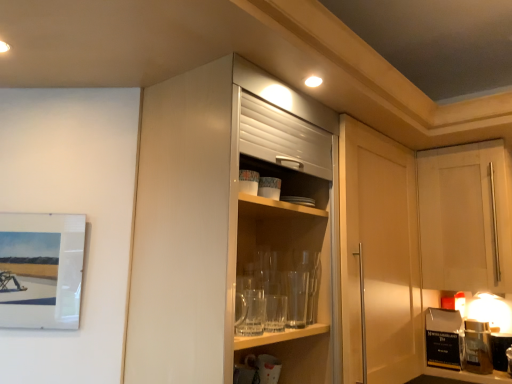
Question: Does glossy white cabinet at center, acting as the second cabinetry starting from the right, have a greater width compared to white matte cabinet at upper right, which appears as the first cabinetry when viewed from the right?

Choices:
 (A) no
 (B) yes

Answer: (A)

Question: Is glossy white cabinet at center, the 1th cabinetry positioned from the left, far from white matte cabinet at upper right, the first cabinetry viewed from the back?

Choices:
 (A) no
 (B) yes

Answer: (A)

Question: Is glossy white cabinet at center, the second cabinetry in the back-to-front sequence, further to camera compared to white matte cabinet at upper right, the first cabinetry viewed from the back?

Choices:
 (A) yes
 (B) no

Answer: (B)

Question: Can you confirm if glossy white cabinet at center, the second cabinetry in the back-to-front sequence, is taller than white matte cabinet at upper right, the second cabinetry from the left?

Choices:
 (A) yes
 (B) no

Answer: (A)

Question: Does glossy white cabinet at center, acting as the second cabinetry starting from the right, appear on the right side of white matte cabinet at upper right, acting as the 2th cabinetry starting from the front?

Choices:
 (A) no
 (B) yes

Answer: (A)

Question: Is point (9, 321) closer or farther from the camera than point (486, 263)?

Choices:
 (A) farther
 (B) closer

Answer: (B)

Question: From a real-world perspective, relative to white matte cabinet at upper right, the second cabinetry from the left, is matte white picture frame at left vertically above or below?

Choices:
 (A) above
 (B) below

Answer: (B)

Question: In the image, is matte white picture frame at left positioned in front of or behind white matte cabinet at upper right, the second cabinetry from the left?

Choices:
 (A) front
 (B) behind

Answer: (A)

Question: Is matte white picture frame at left wider or thinner than white matte cabinet at upper right, the first cabinetry viewed from the back?

Choices:
 (A) wide
 (B) thin

Answer: (B)

Question: Would you say white matte cabinet at upper right, the second cabinetry from the left, is to the left or to the right of matte white picture frame at left in the picture?

Choices:
 (A) left
 (B) right

Answer: (B)

Question: From the image's perspective, relative to matte white picture frame at left, is white matte cabinet at upper right, acting as the 2th cabinetry starting from the front, above or below?

Choices:
 (A) below
 (B) above

Answer: (B)

Question: In the image, is white matte cabinet at upper right, which appears as the first cabinetry when viewed from the right, positioned in front of or behind matte white picture frame at left?

Choices:
 (A) front
 (B) behind

Answer: (B)

Question: In terms of size, does white matte cabinet at upper right, acting as the 2th cabinetry starting from the front, appear bigger or smaller than matte white picture frame at left?

Choices:
 (A) small
 (B) big

Answer: (B)

Question: From their relative heights in the image, would you say glossy white cabinet at center, which ranks as the first cabinetry in front-to-back order, is taller or shorter than matte white picture frame at left?

Choices:
 (A) tall
 (B) short

Answer: (A)

Question: Based on their sizes in the image, would you say glossy white cabinet at center, which ranks as the first cabinetry in front-to-back order, is bigger or smaller than matte white picture frame at left?

Choices:
 (A) big
 (B) small

Answer: (A)